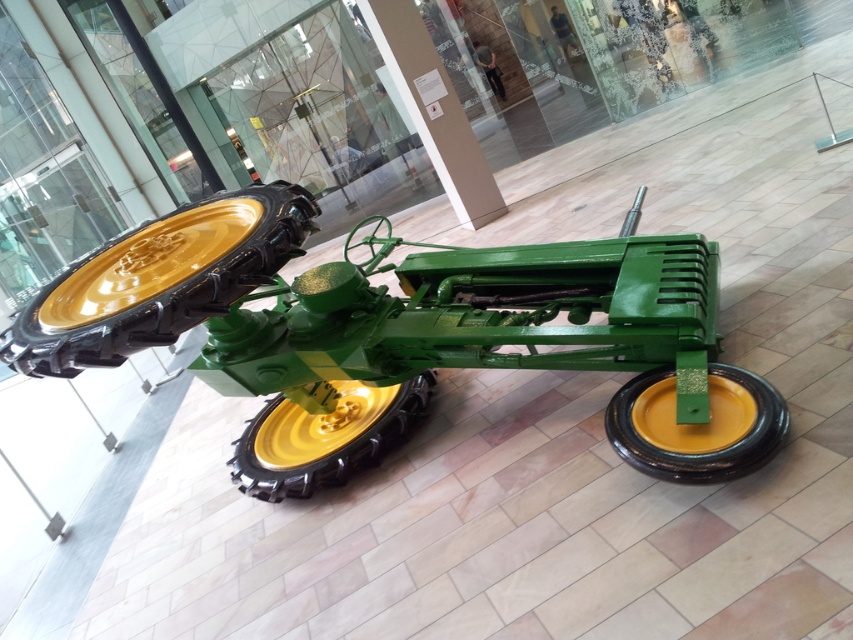
Question: Which object appears farthest from the camera in this image?

Choices:
 (A) shiny yellow rubber wheel at center
 (B) green matte tractor at center
 (C) yellow rubber wheel at center

Answer: (C)

Question: Which point is farther from the camera taking this photo?

Choices:
 (A) (293, 211)
 (B) (444, 348)
 (C) (352, 412)
 (D) (720, 445)

Answer: (C)

Question: Does shiny yellow rubber wheel at center appear under yellow rubber wheel at center?

Choices:
 (A) no
 (B) yes

Answer: (A)

Question: Which point is closer to the camera?

Choices:
 (A) shiny yellow rubber wheel at center
 (B) green matte tractor at center
 (C) yellow rubber wheel at center
 (D) shiny yellow rimmed tire at center

Answer: (D)

Question: Is shiny yellow rubber wheel at center closer to the viewer compared to shiny yellow rimmed tire at center?

Choices:
 (A) no
 (B) yes

Answer: (A)

Question: Can you confirm if green matte tractor at center is positioned to the left of yellow rubber wheel at center?

Choices:
 (A) yes
 (B) no

Answer: (B)